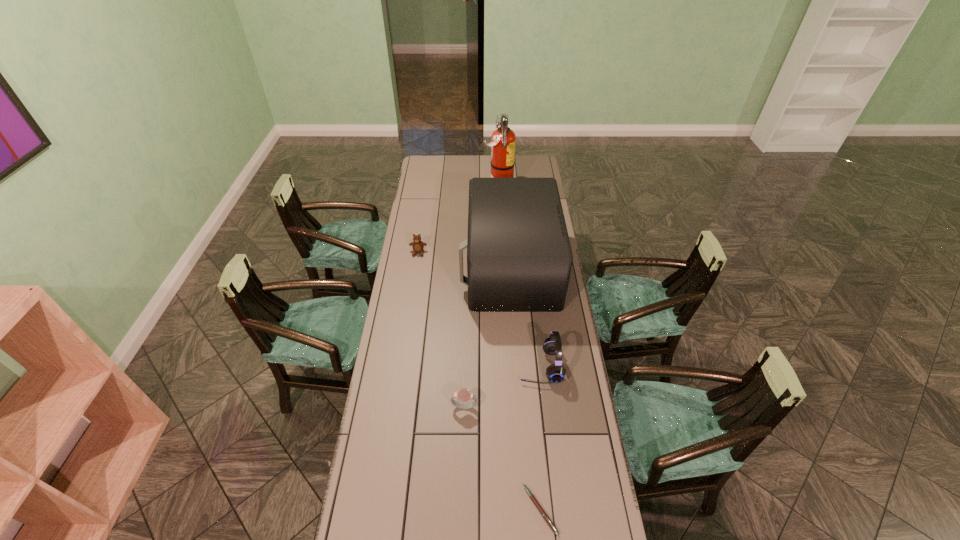
The image size is (960, 540). What are the coordinates of `pen` in the screenshot? It's located at (544, 514).

The image size is (960, 540). Find the location of `vacant space located 0.260m from the nozzle of the tallest object`. vacant space located 0.260m from the nozzle of the tallest object is located at coordinates (438, 191).

Locate an element on the screen. This screenshot has width=960, height=540. vacant position located 0.400m from the nozzle of the tallest object is located at coordinates (413, 191).

This screenshot has height=540, width=960. In order to click on free point located from the nozzle of the tallest object in this screenshot , I will do (449, 191).

Find the location of a particular element. vacant space positioned on the front-facing side of the fifth shortest object is located at coordinates (421, 268).

Identify the location of vacant space located 0.160m on the front-facing side of the fifth shortest object. (428, 268).

This screenshot has width=960, height=540. What are the coordinates of `vacant position located on the front-facing side of the fifth shortest object` in the screenshot? It's located at [x=451, y=268].

At what (x,y) coordinates should I click in order to perform the action: click on free space located 0.240m on the ear cushions of the third tallest object. Please return your answer as a coordinate pair (x, y). The width and height of the screenshot is (960, 540). Looking at the image, I should click on (456, 366).

Find the location of a particular element. Image resolution: width=960 pixels, height=540 pixels. vacant space located 0.110m on the ear cushions of the third tallest object is located at coordinates (490, 366).

Identify the location of free spot located 0.150m on the ear cushions of the third tallest object. (479, 366).